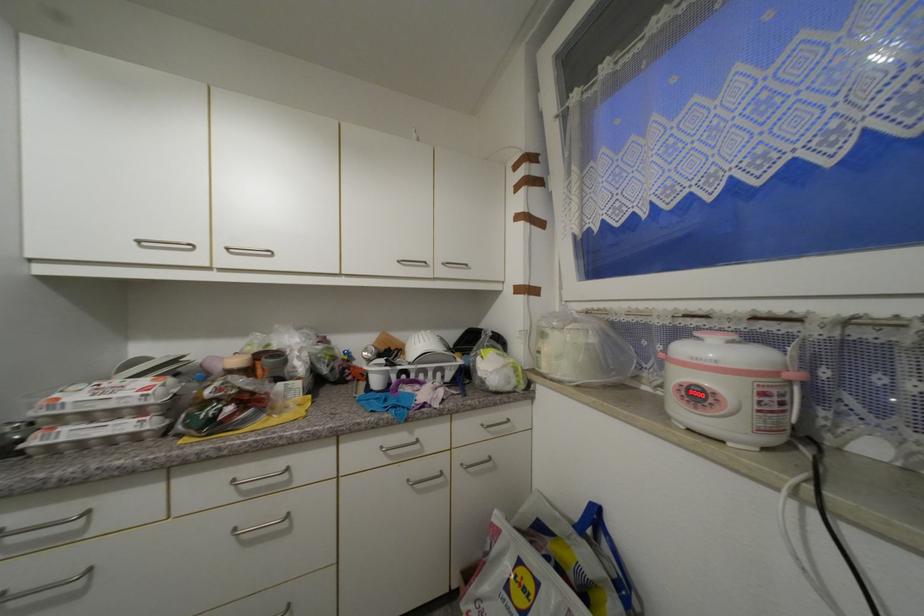
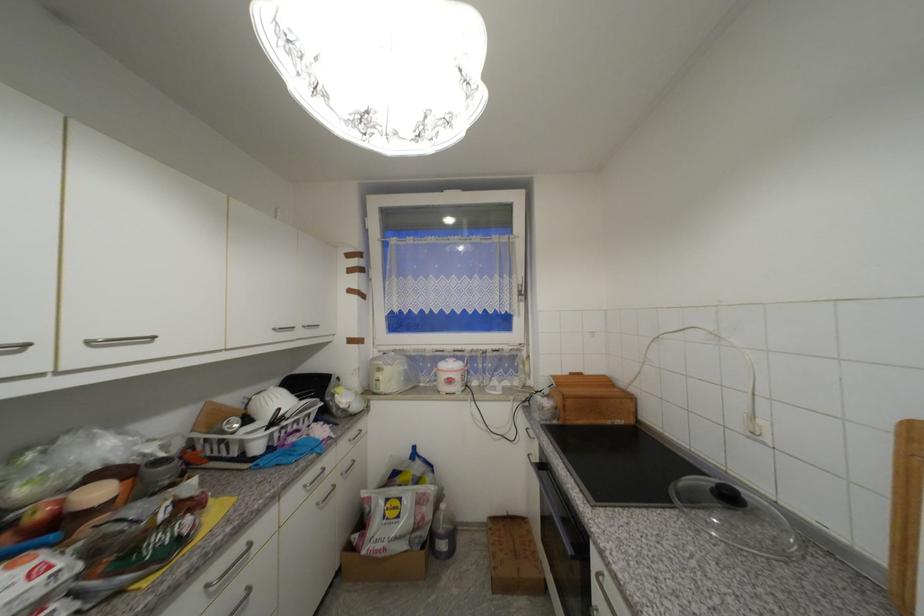
In the second image, find the point that corresponds to [387,448] in the first image.

(310, 488)